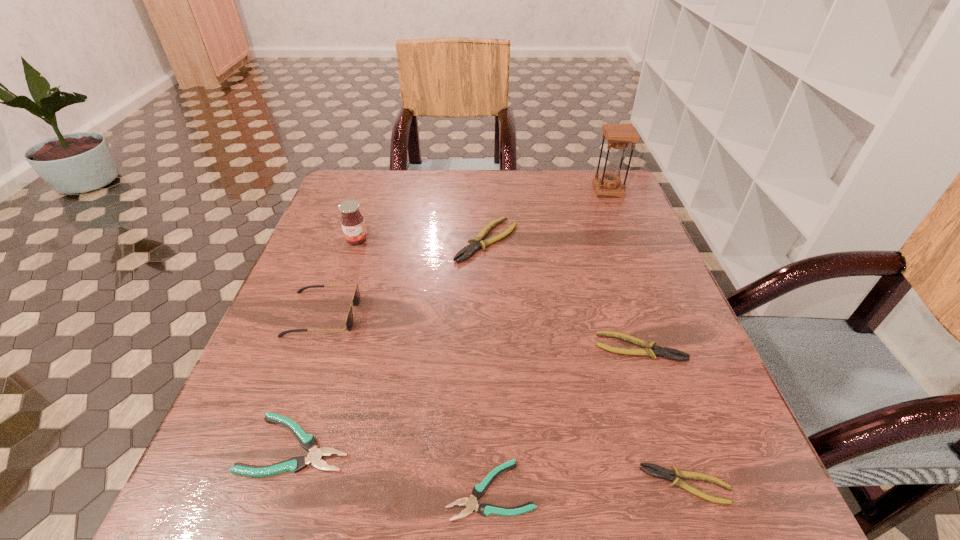
You are a GUI agent. You are given a task and a screenshot of the screen. Output one action in this format:
    pyautogui.click(x=<x>, y=<y>)
    Task: Click on the vacant point located on the back of the smallest yellow pliers
    The image size is (960, 540).
    Given the screenshot: What is the action you would take?
    pyautogui.click(x=627, y=311)

The width and height of the screenshot is (960, 540). I want to click on vacant area located on the left of the shortest object, so click(336, 490).

I want to click on object present at the far edge, so click(618, 136).

Where is `jam at the left edge`? The width and height of the screenshot is (960, 540). jam at the left edge is located at coordinates (352, 221).

At what (x,y) coordinates should I click in order to perform the action: click on sunglasses located at the left edge. Please return your answer as a coordinate pair (x, y). Looking at the image, I should click on (355, 300).

The height and width of the screenshot is (540, 960). I want to click on pliers situated at the left edge, so click(308, 442).

Locate an element on the screen. hourglass present at the right edge is located at coordinates (618, 136).

This screenshot has height=540, width=960. In order to click on object located at the near left corner in this screenshot , I will do `click(308, 442)`.

This screenshot has width=960, height=540. I want to click on object that is at the far right corner, so click(x=618, y=136).

Locate an element on the screen. object located at the near right corner is located at coordinates [662, 473].